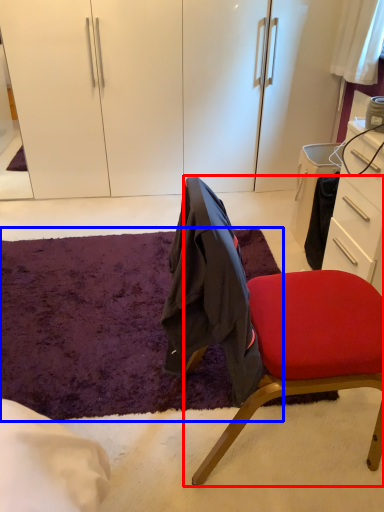
Question: Which point is closer to the camera, chair (highlighted by a red box) or mat (highlighted by a blue box)?

Choices:
 (A) chair
 (B) mat

Answer: (A)